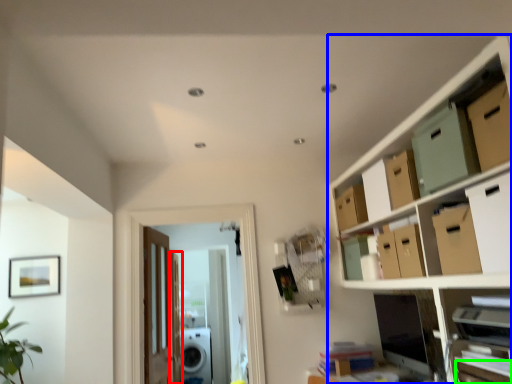
Question: Which object is the closest to the door (highlighted by a red box)? Choose among these: cabinetry (highlighted by a blue box) or drawer (highlighted by a green box).

Choices:
 (A) cabinetry
 (B) drawer

Answer: (A)